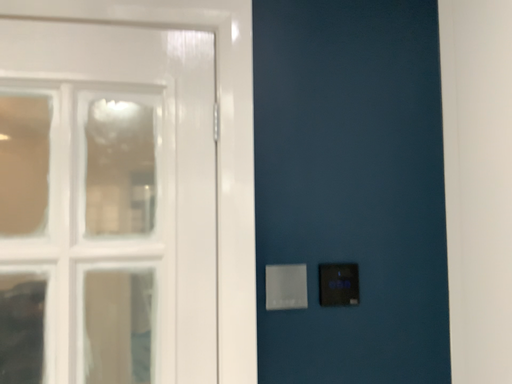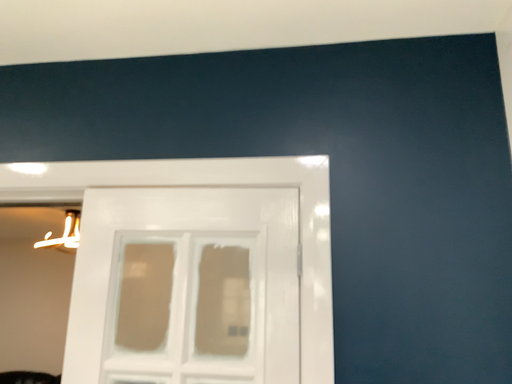
Question: Which way did the camera rotate in the video?

Choices:
 (A) rotated upward
 (B) rotated downward

Answer: (A)